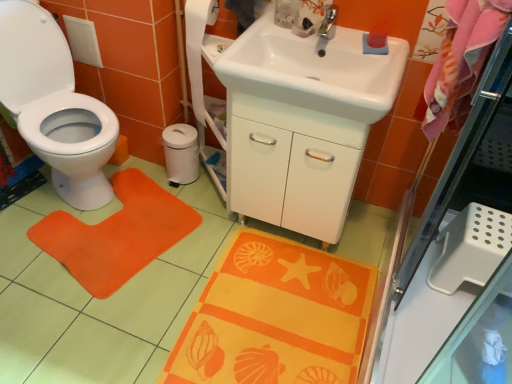
Question: Can you confirm if white glossy sink at center, the first sink viewed from the back, is taller than white matte toilet paper at center?

Choices:
 (A) yes
 (B) no

Answer: (A)

Question: Is white glossy sink at center, which is counted as the 2th sink, starting from the front, at the right side of white matte toilet paper at center?

Choices:
 (A) no
 (B) yes

Answer: (B)

Question: Can you confirm if white glossy sink at center, which is counted as the 2th sink, starting from the front, is thinner than white matte toilet paper at center?

Choices:
 (A) no
 (B) yes

Answer: (A)

Question: From a real-world perspective, is white glossy sink at center, the first sink viewed from the back, below white matte toilet paper at center?

Choices:
 (A) yes
 (B) no

Answer: (B)

Question: Is white glossy sink at center, the first sink viewed from the back, positioned before white matte toilet paper at center?

Choices:
 (A) yes
 (B) no

Answer: (A)

Question: From the image's perspective, is transparent glass screen door at upper right located above or below white glossy toilet at left?

Choices:
 (A) above
 (B) below

Answer: (B)

Question: In the image, is transparent glass screen door at upper right positioned in front of or behind white glossy toilet at left?

Choices:
 (A) front
 (B) behind

Answer: (A)

Question: From a real-world perspective, is transparent glass screen door at upper right physically located above or below white glossy toilet at left?

Choices:
 (A) below
 (B) above

Answer: (B)

Question: Which is correct: transparent glass screen door at upper right is inside white glossy toilet at left, or outside of it?

Choices:
 (A) outside
 (B) inside

Answer: (A)

Question: From the image's perspective, is white matte toilet paper at center positioned above or below white glossy sink at upper center, the 1th sink when ordered from front to back?

Choices:
 (A) below
 (B) above

Answer: (A)

Question: In the image, is white matte toilet paper at center positioned in front of or behind white glossy sink at upper center, marked as the 2th sink in a back-to-front arrangement?

Choices:
 (A) front
 (B) behind

Answer: (B)

Question: Is white matte toilet paper at center taller or shorter than white glossy sink at upper center, marked as the 2th sink in a back-to-front arrangement?

Choices:
 (A) tall
 (B) short

Answer: (A)

Question: From a real-world perspective, is white matte toilet paper at center physically located above or below white glossy sink at upper center, marked as the 2th sink in a back-to-front arrangement?

Choices:
 (A) below
 (B) above

Answer: (A)

Question: Is point (79, 226) positioned closer to the camera than point (381, 81)?

Choices:
 (A) farther
 (B) closer

Answer: (A)

Question: Is orange fabric doormat at left wider or thinner than white glossy sink at upper center, marked as the 2th sink in a back-to-front arrangement?

Choices:
 (A) wide
 (B) thin

Answer: (A)